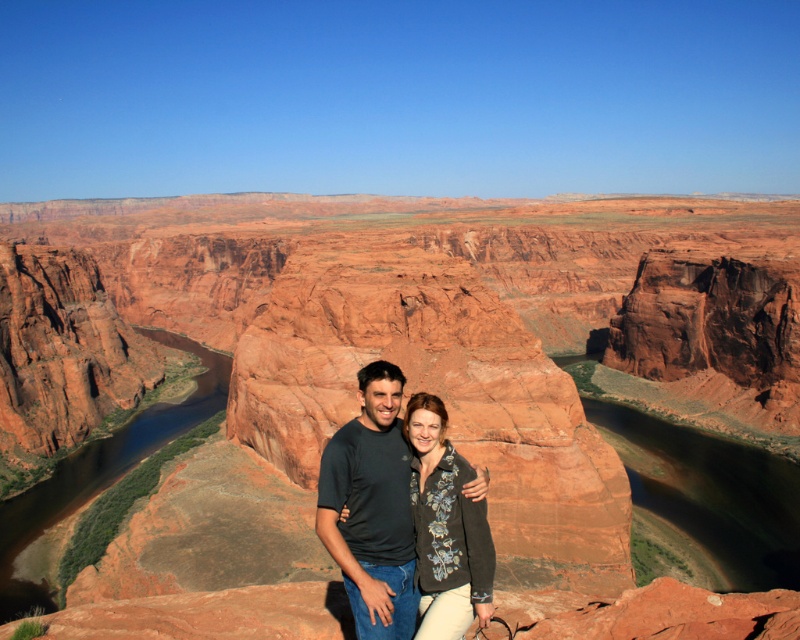
Consider the image. You are a photographer planning to take a photo of the Horseshoe Bend landscape. You want to include both the brown smooth river at center and the dark gray textured sweater at center in your shot. According to the scene description, which object is positioned closer to the camera?

The brown smooth river at center is closer to the camera because the dark gray textured sweater at center is positioned behind it.

You are standing at the viewpoint of Horseshoe Bend and see two points marked in the image. The first point is at coordinate point [720,252] and the second is at point [376,376]. Which point is closer to the edge of the cliff?

Point [376,376] is closer to the edge of the cliff because it is in front of point [720,252].